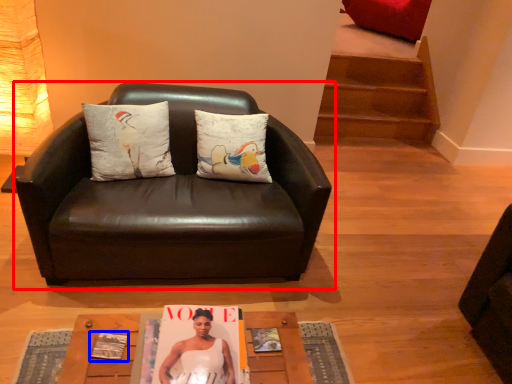
Question: Which of the following is the farthest to the observer, chair (highlighted by a red box) or magazine (highlighted by a blue box)?

Choices:
 (A) chair
 (B) magazine

Answer: (A)